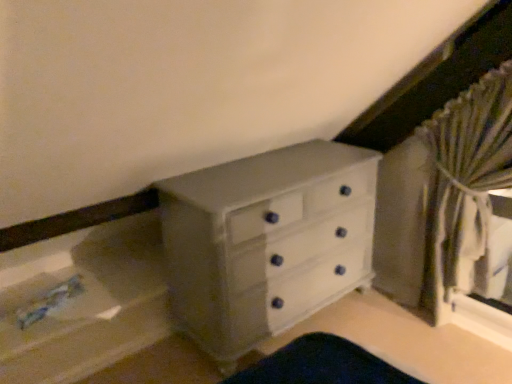
I want to click on white painted wood chest of drawers at center, so click(267, 241).

What do you see at coordinates (267, 241) in the screenshot? I see `white painted wood chest of drawers at center` at bounding box center [267, 241].

What do you see at coordinates (444, 199) in the screenshot?
I see `striped fabric curtain at right` at bounding box center [444, 199].

At what (x,y) coordinates should I click in order to perform the action: click on striped fabric curtain at right. Please return your answer as a coordinate pair (x, y). The image size is (512, 384). Looking at the image, I should click on (444, 199).

The image size is (512, 384). What are the coordinates of `white painted wood chest of drawers at center` in the screenshot? It's located at (267, 241).

Is white painted wood chest of drawers at center to the right of striped fabric curtain at right from the viewer's perspective?

No, white painted wood chest of drawers at center is not to the right of striped fabric curtain at right.

Is white painted wood chest of drawers at center positioned behind striped fabric curtain at right?

Yes, the depth of white painted wood chest of drawers at center is greater than that of striped fabric curtain at right.

Is point (273, 242) positioned in front of point (461, 120)?

Yes, point (273, 242) is in front of point (461, 120).

From the image's perspective, is white painted wood chest of drawers at center located above striped fabric curtain at right?

No, from the image's perspective, white painted wood chest of drawers at center is not above striped fabric curtain at right.

From a real-world perspective, which object rests below the other?

From a 3D spatial view, white painted wood chest of drawers at center is below.

Looking at their sizes, would you say white painted wood chest of drawers at center is wider or thinner than striped fabric curtain at right?

Clearly, white painted wood chest of drawers at center has more width compared to striped fabric curtain at right.

Is white painted wood chest of drawers at center taller than striped fabric curtain at right?

In fact, white painted wood chest of drawers at center may be shorter than striped fabric curtain at right.

Which of these two, white painted wood chest of drawers at center or striped fabric curtain at right, is smaller?

striped fabric curtain at right is smaller.

Is striped fabric curtain at right inside white painted wood chest of drawers at center?

No.

Are white painted wood chest of drawers at center and striped fabric curtain at right beside each other?

No.

Is white painted wood chest of drawers at center turned away from striped fabric curtain at right?

No, white painted wood chest of drawers at center is not facing the opposite direction of striped fabric curtain at right.

Where is `curtain in front of the white painted wood chest of drawers at center`? The width and height of the screenshot is (512, 384). curtain in front of the white painted wood chest of drawers at center is located at coordinates (444, 199).

In the scene shown: Considering the relative positions of striped fabric curtain at right and white painted wood chest of drawers at center in the image provided, is striped fabric curtain at right to the left or to the right of white painted wood chest of drawers at center?

In the image, striped fabric curtain at right appears on the right side of white painted wood chest of drawers at center.

Is striped fabric curtain at right positioned before white painted wood chest of drawers at center?

Yes, the depth of striped fabric curtain at right is less than that of white painted wood chest of drawers at center.

Considering the points (501, 103) and (346, 231), which point is in front, point (501, 103) or point (346, 231)?

Positioned in front is point (501, 103).

From the image's perspective, is striped fabric curtain at right on top of white painted wood chest of drawers at center?

Indeed, from the image's perspective, striped fabric curtain at right is shown above white painted wood chest of drawers at center.

From a real-world perspective, does striped fabric curtain at right stand above white painted wood chest of drawers at center?

Yes, from a real-world perspective, striped fabric curtain at right is over white painted wood chest of drawers at center

Which of these two, striped fabric curtain at right or white painted wood chest of drawers at center, is wider?

With larger width is white painted wood chest of drawers at center.

Is striped fabric curtain at right taller than white painted wood chest of drawers at center?

Indeed, striped fabric curtain at right has a greater height compared to white painted wood chest of drawers at center.

Who is bigger, striped fabric curtain at right or white painted wood chest of drawers at center?

With larger size is white painted wood chest of drawers at center.

Looking at this image, would you say striped fabric curtain at right is outside white painted wood chest of drawers at center?

Yes, striped fabric curtain at right is not within white painted wood chest of drawers at center.

Is striped fabric curtain at right in contact with white painted wood chest of drawers at center?

No, striped fabric curtain at right is not next to white painted wood chest of drawers at center.

Is striped fabric curtain at right aimed at white painted wood chest of drawers at center?

No.

Measure the distance between striped fabric curtain at right and white painted wood chest of drawers at center.

They are 24.39 inches apart.

You are a GUI agent. You are given a task and a screenshot of the screen. Output one action in this format:
    pyautogui.click(x=<x>, y=<y>)
    Task: Click on the curtain above the white painted wood chest of drawers at center (from a real-world perspective)
    
    Given the screenshot: What is the action you would take?
    pyautogui.click(x=444, y=199)

Identify the location of curtain that is above the white painted wood chest of drawers at center (from the image's perspective). Image resolution: width=512 pixels, height=384 pixels. (444, 199).

The image size is (512, 384). Identify the location of curtain that is in front of the white painted wood chest of drawers at center. (444, 199).